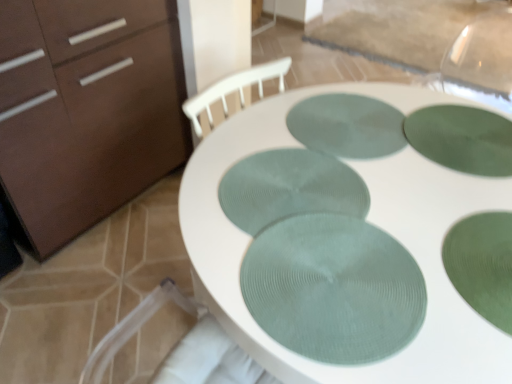
At what (x,y) coordinates should I click in order to perform the action: click on vacant space behind green textured glass plate at center, the 3th glass plate viewed from the back. Please return your answer as a coordinate pair (x, y). This screenshot has height=384, width=512. Looking at the image, I should click on (300, 127).